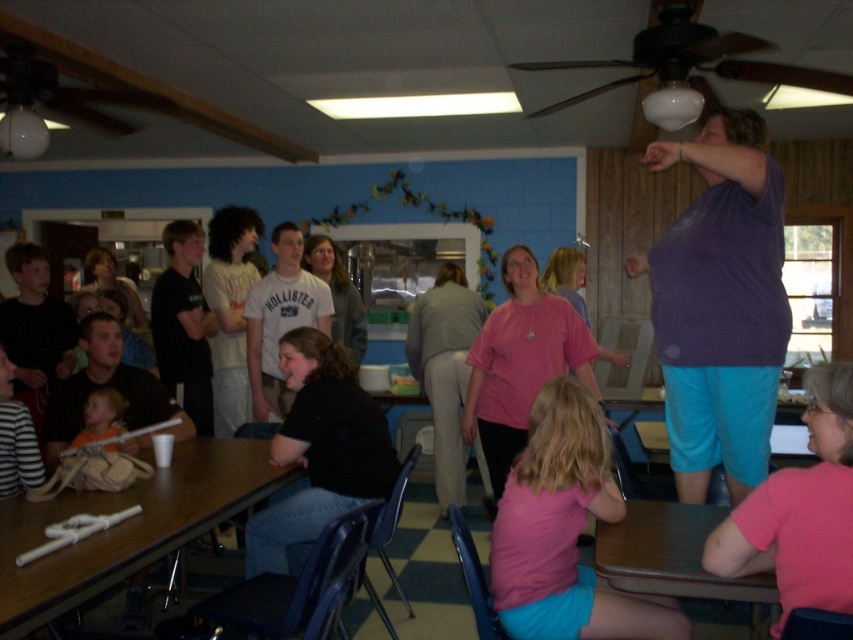
Question: Does pink matte shirt at lower center appear over wooden table at center?

Choices:
 (A) yes
 (B) no

Answer: (A)

Question: Which point is closer to the camera?

Choices:
 (A) brown wood table at lower right
 (B) wooden table at center
 (C) pink matte shirt at lower center
 (D) purple matte shirt at upper right

Answer: (B)

Question: Is pink matte shirt at lower center to the left of matte orange shirt at lower left from the viewer's perspective?

Choices:
 (A) no
 (B) yes

Answer: (A)

Question: Among these objects, which one is farthest from the camera?

Choices:
 (A) matte orange shirt at lower left
 (B) purple matte shirt at upper right
 (C) wooden table at center

Answer: (A)

Question: Which of the following is the closest to the observer?

Choices:
 (A) wooden table at center
 (B) matte orange shirt at lower left
 (C) pink fabric shirt at lower right

Answer: (A)

Question: Is pink matte shirt at lower center behind matte orange shirt at lower left?

Choices:
 (A) yes
 (B) no

Answer: (B)